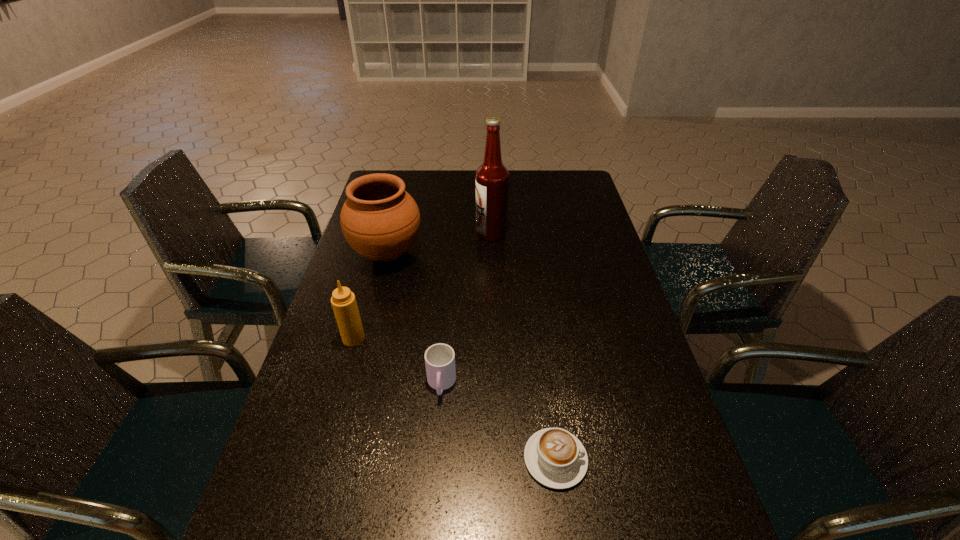
The image size is (960, 540). I want to click on vacant space in between the second shortest object and the nearest object, so coord(498,422).

Identify which object is the closest to the second object from right to left. Please provide its 2D coordinates. Your answer should be formatted as a tuple, i.e. [(x, y)], where the tuple contains the x and y coordinates of a point satisfying the conditions above.

[(381, 221)]

You are a GUI agent. You are given a task and a screenshot of the screen. Output one action in this format:
    pyautogui.click(x=<x>, y=<y>)
    Task: Click on the object that ranks as the closest to the tallest object
    
    Given the screenshot: What is the action you would take?
    click(x=381, y=221)

Locate an element on the screen. The image size is (960, 540). free space in the image that satisfies the following two spatial constraints: 1. on the label side of the alcohol; 2. with the handle on the side of the cup is located at coordinates (496, 384).

Locate an element on the screen. Image resolution: width=960 pixels, height=540 pixels. blank area in the image that satisfies the following two spatial constraints: 1. on the back side of the third tallest object; 2. on the right side of the pottery is located at coordinates (377, 254).